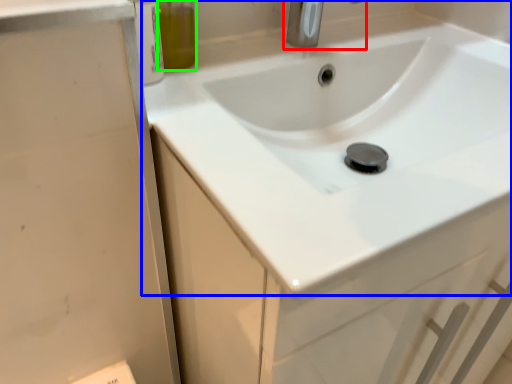
Question: Considering the real-world distances, which object is closest to tap (highlighted by a red box)? sink (highlighted by a blue box) or olive oil (highlighted by a green box).

Choices:
 (A) sink
 (B) olive oil

Answer: (B)